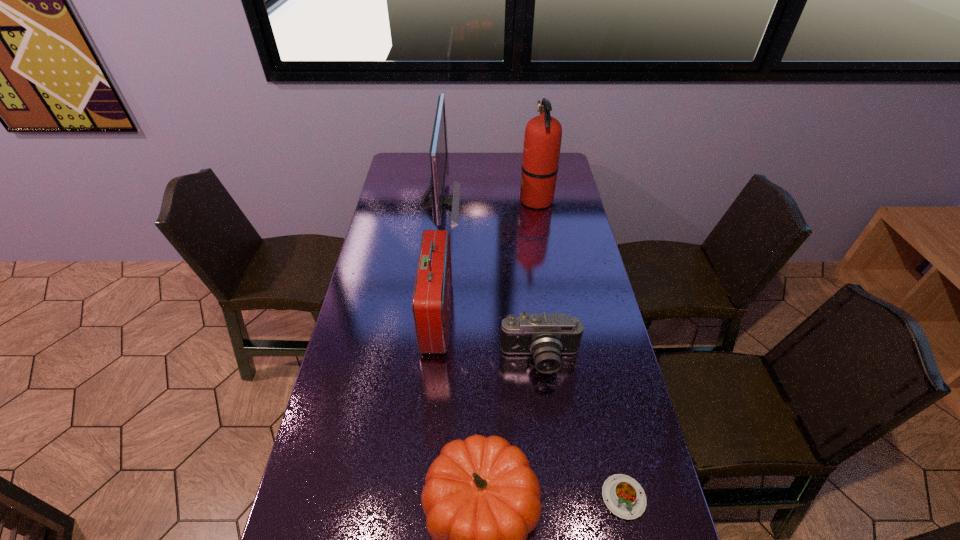
Image resolution: width=960 pixels, height=540 pixels. I want to click on vacant region that satisfies the following two spatial constraints: 1. on the back side of the pudding; 2. on the side of the third tallest object with the first aid cross symbol, so click(x=583, y=316).

Image resolution: width=960 pixels, height=540 pixels. Identify the location of free location that satisfies the following two spatial constraints: 1. on the side of the first-aid kit with the first aid cross symbol; 2. on the right side of the shortest object. (420, 497).

At what (x,y) coordinates should I click in order to perform the action: click on free space that satisfies the following two spatial constraints: 1. on the screen side of the monitor; 2. on the right side of the shortest object. Please return your answer as a coordinate pair (x, y). Looking at the image, I should click on (407, 497).

This screenshot has height=540, width=960. What are the coordinates of `free space that satisfies the following two spatial constraints: 1. on the side of the shortest object with the nozzle and handle; 2. on the left side of the tallest object` in the screenshot? It's located at (585, 497).